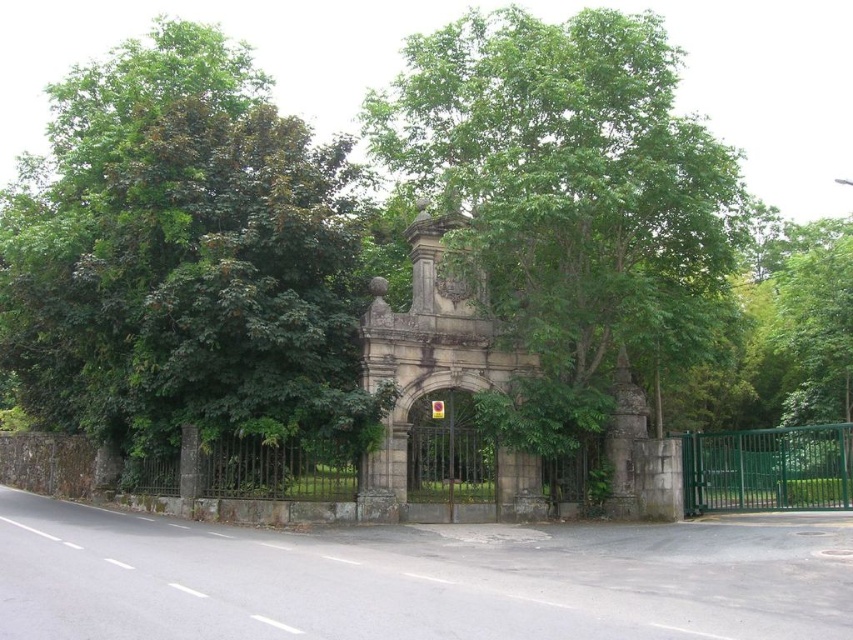
You are a delivery person trying to enter the park through the green metallic gate at center. You notice a green leafy tree at center blocking your path. Is the distance between the tree and the gate sufficient for your 2.5 meter long delivery truck to maneuver around the tree and reach the gate?

The green leafy tree at center and green metallic gate at center are 9.71 meters apart. Since the truck is 2.5 meters long, there is enough space between the tree and the gate for the truck to maneuver around the tree and reach the gate.

You are standing at the entrance of the park and see the green leafy tree at center. If you walk straight ahead, will you eventually see the metal fence on your left or right side?

Since the green leafy tree at center is located at point (566,195), which is near the center of the image, walking straight ahead would keep the tree in front of you. The metal fence extends along the sides of the road, so as you walk forward, the fence would be on both sides of the path. However, since the tree is centered, the fence would be equally on both left and right sides. But since the question asks for left or right, the answer is neither, but the fence is on both sides. However, according to 3

You are a delivery person trying to enter through the green metallic gate at center. There is a green leafy tree at left nearby. Do you think the tree might block your path when opening the gate?

The green leafy tree at left is positioned over the green metallic gate at center, so it might block your path when opening the gate.